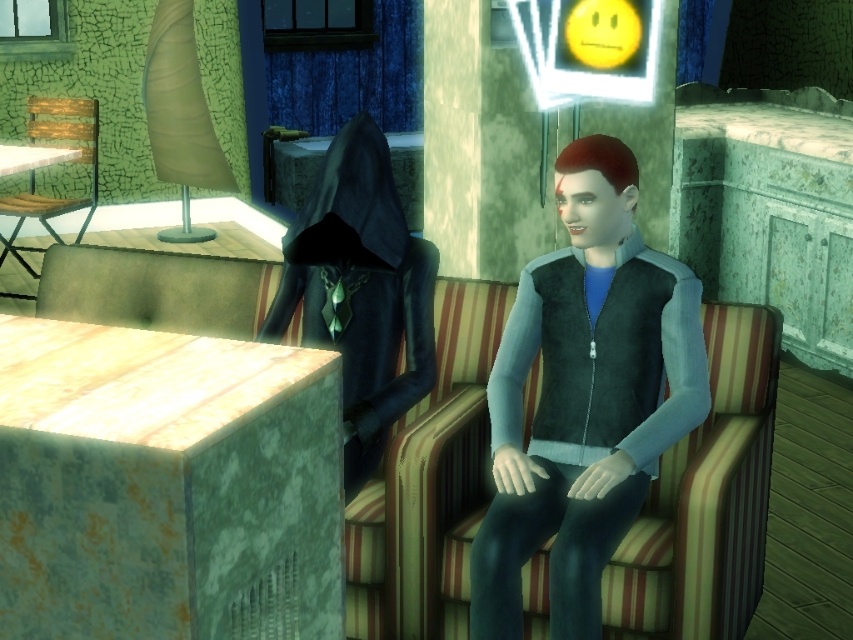
You are a character in the game and need to determine which of the two points, point (x=90, y=276) or point (x=79, y=160), is closer to you. Based on the scene description, which point is nearer?

Point (x=90, y=276) is closer to the viewer than point (x=79, y=160), so the closer point is point (x=90, y=276).

You are a character in the game who needs to move from the wooden slats chair at left to the striped fabric armchair at center. Can you walk directly between them without needing to go around any obstacles?

The striped fabric armchair at center is 5.35 meters away from the wooden slats chair at left. Since there are no obstacles mentioned in the scene description, you can walk directly between them.

You are a game developer designing a scene where a character needs to sit on the matte brown cushion at left while facing the wooden slats chair at left. Given their sizes, will the cushion provide enough space for the character to comfortably turn towards the chair?

The matte brown cushion at left is wider than the wooden slats chair at left, so yes, the cushion should provide sufficient space for the character to turn comfortably towards the chair.